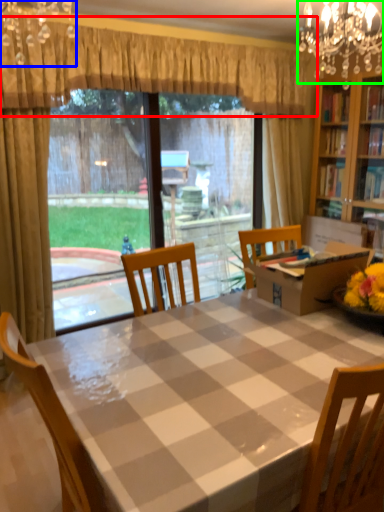
Question: Which object is the farthest from curtain (highlighted by a red box)? Choose among these: light fixture (highlighted by a blue box) or light fixture (highlighted by a green box).

Choices:
 (A) light fixture
 (B) light fixture

Answer: (B)